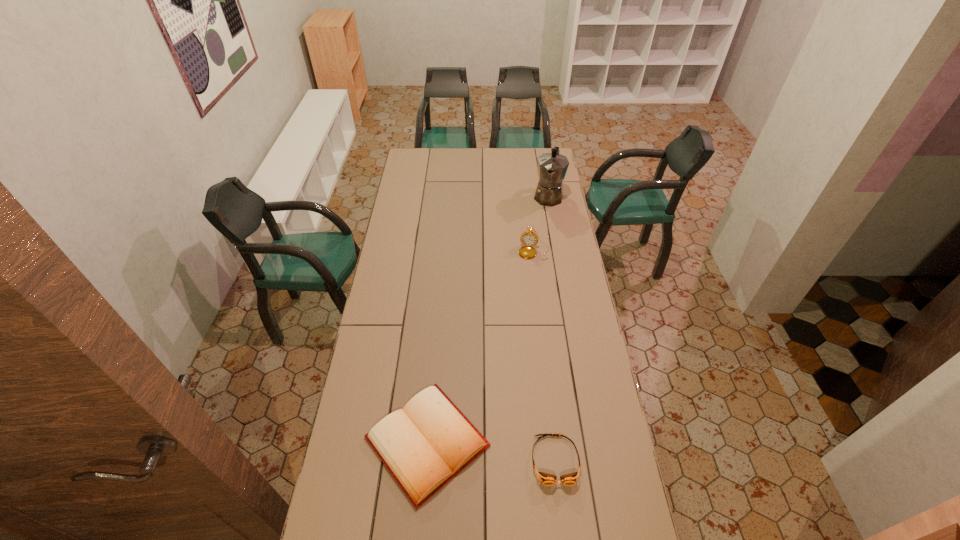
Locate an element on the screen. The height and width of the screenshot is (540, 960). vacant space on the desktop that is between the leftmost object and the goggles and is positioned on the pouring side of the tallest object is located at coordinates [478, 449].

Where is `vacant spot on the desktop that is between the Bible and the goggles and is positioned on the face of the pocket watch`? vacant spot on the desktop that is between the Bible and the goggles and is positioned on the face of the pocket watch is located at coordinates (502, 453).